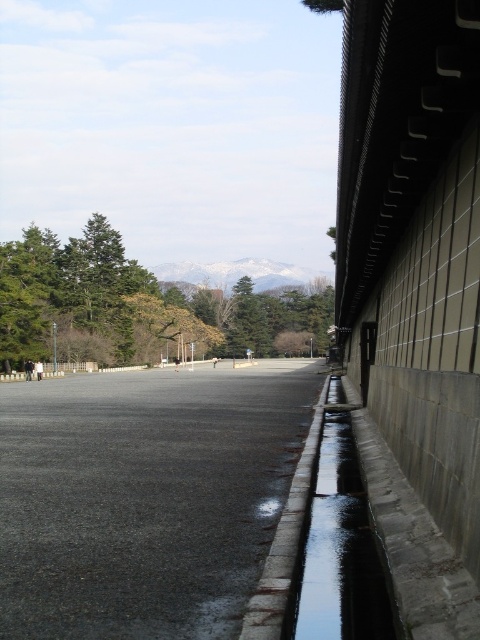
Question: Among these points, which one is nearest to the camera?

Choices:
 (A) (96, 218)
 (B) (261, 573)
 (C) (191, 401)
 (D) (312, 614)

Answer: (D)

Question: In this image, where is black asphalt pavement at center located relative to gray concrete curb at lower right?

Choices:
 (A) below
 (B) above

Answer: (A)

Question: Is black asphalt pavement at center to the right of green leafy tree at upper left from the viewer's perspective?

Choices:
 (A) yes
 (B) no

Answer: (A)

Question: Does clear glass puddle at right appear over gray concrete curb at lower right?

Choices:
 (A) no
 (B) yes

Answer: (B)

Question: Based on their relative distances, which object is farther from the clear glass puddle at right?

Choices:
 (A) gray concrete curb at lower right
 (B) green leafy tree at upper left
 (C) black asphalt pavement at center

Answer: (B)

Question: Which object appears farthest from the camera in this image?

Choices:
 (A) black asphalt pavement at center
 (B) gray concrete curb at lower right
 (C) green leafy tree at upper left
 (D) clear glass puddle at right

Answer: (C)